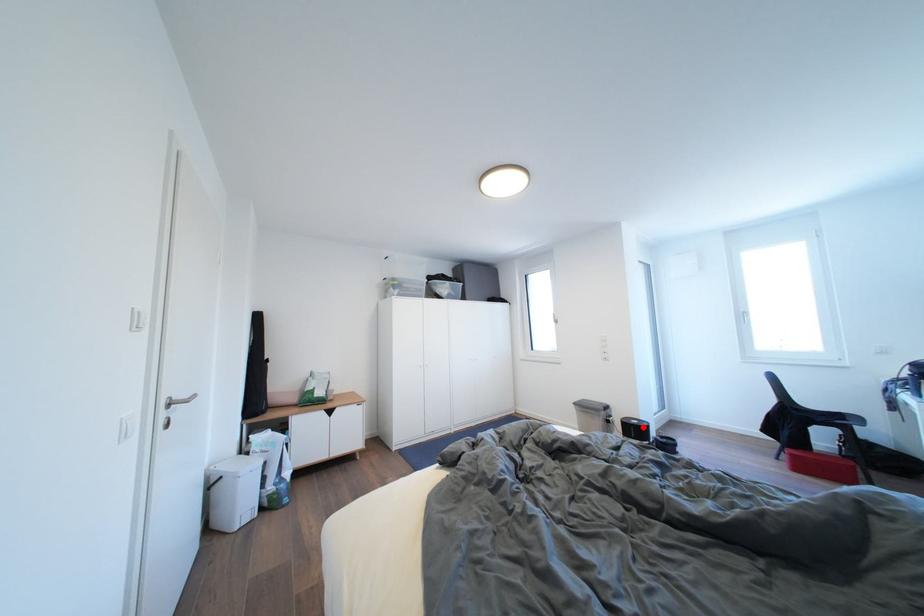
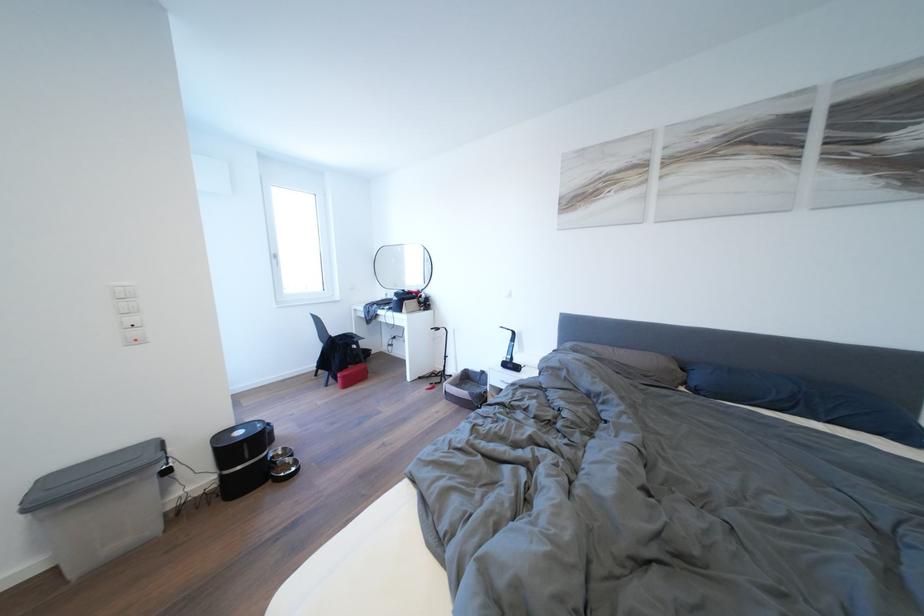
Question: I am providing you with two images of the same scene from different viewpoints. In image1, a red point is highlighted. Considering the same 3D point in image2, which of the following is correct?

Choices:
 (A) It is closer
 (B) It is farther

Answer: (A)